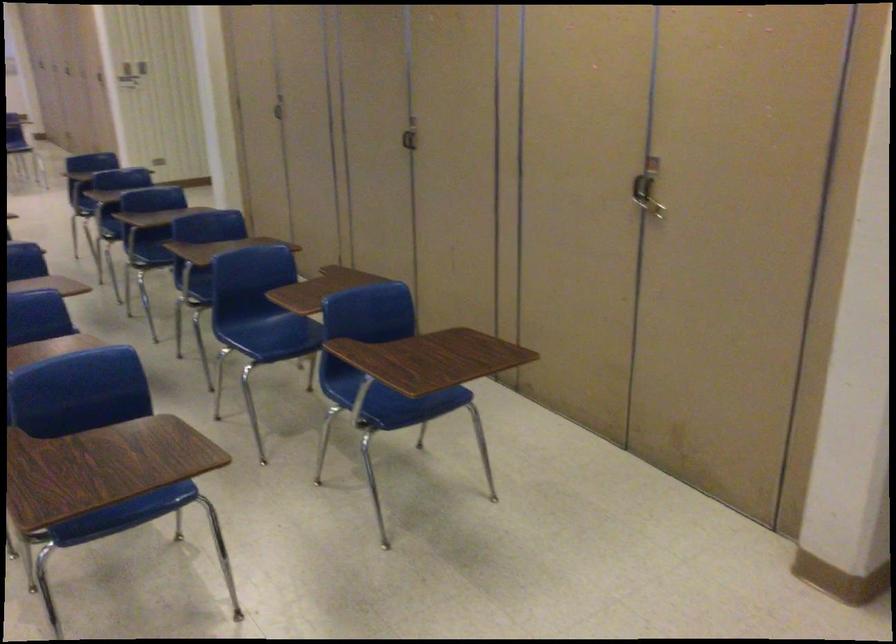
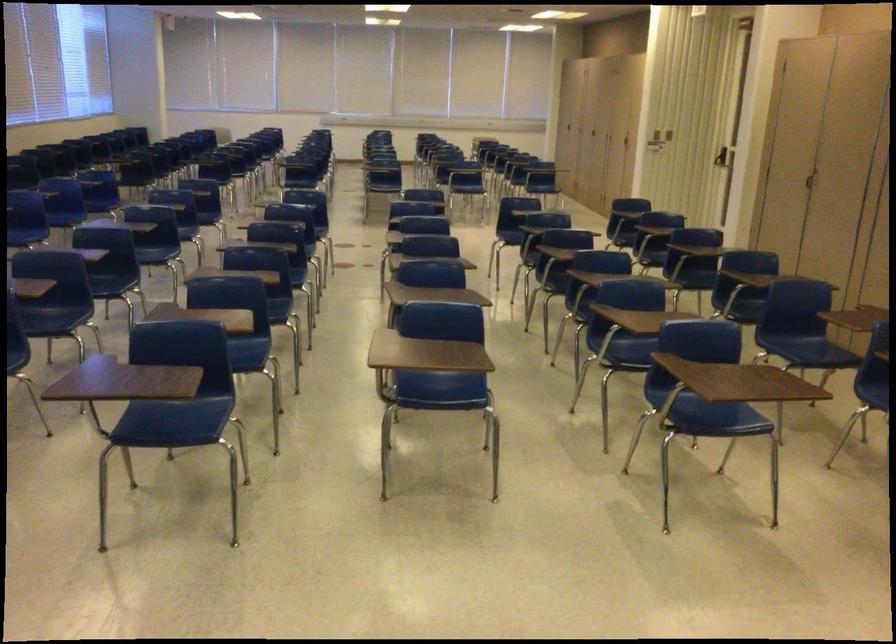
Where in the second image is the point corresponding to the point at 277,115 from the first image?

(808, 180)